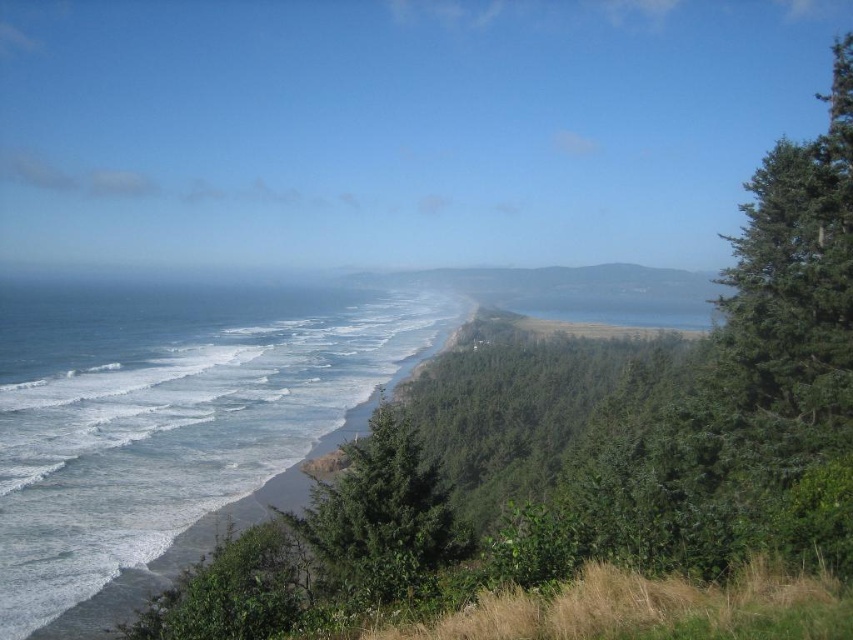
Which is below, blue water at lower left or green leafy tree at center?

green leafy tree at center is below.

Does blue water at lower left have a smaller size compared to green leafy tree at center?

No.

I want to click on blue water at lower left, so click(172, 424).